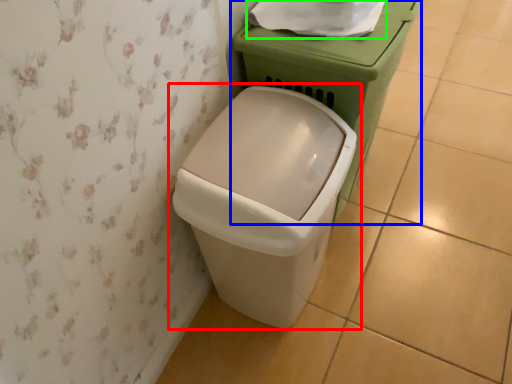
Question: Which is farther away from waste container (highlighted by a red box)? porcelain (highlighted by a blue box) or toilet paper (highlighted by a green box)?

Choices:
 (A) porcelain
 (B) toilet paper

Answer: (B)